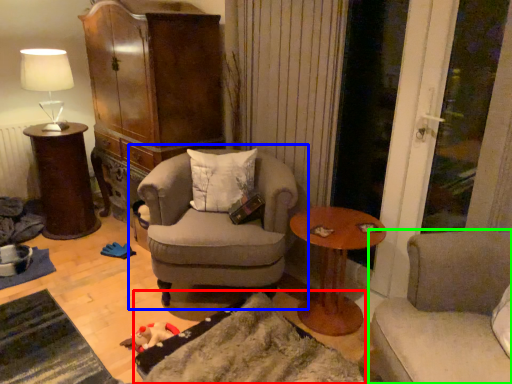
Question: Which is farther away from wide (highlighted by a red box)? chair (highlighted by a blue box) or studio couch (highlighted by a green box)?

Choices:
 (A) chair
 (B) studio couch

Answer: (B)